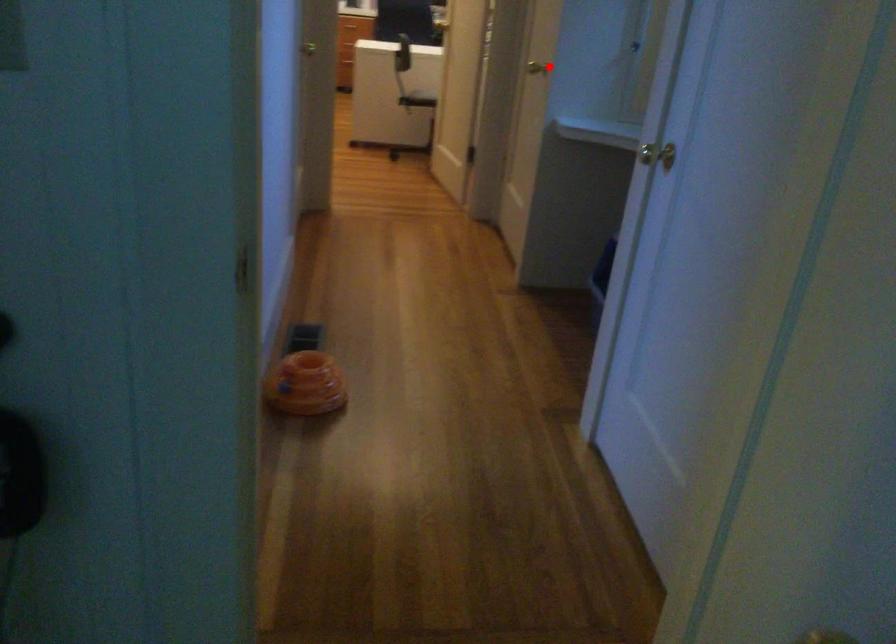
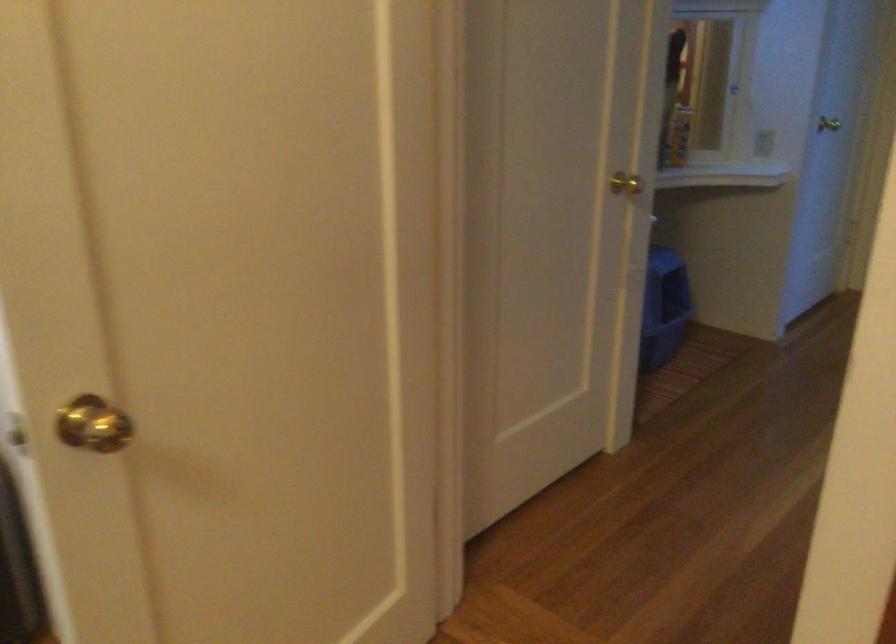
Question: I am providing you with two images of the same scene from different viewpoints. A red point is shown in image1. For the corresponding object point in image2, is it positioned nearer or farther from the camera?

Choices:
 (A) Nearer
 (B) Farther

Answer: (A)